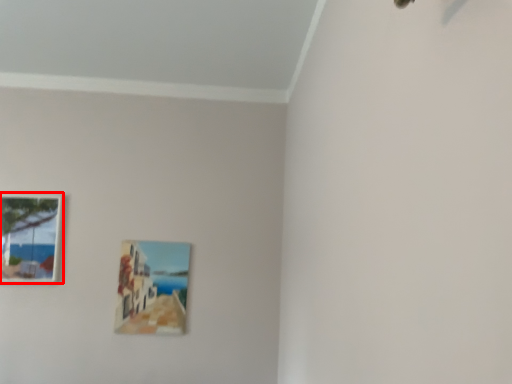
Question: From the image's perspective, what is the correct spatial positioning of picture frame (annotated by the red box) in reference to picture frame?

Choices:
 (A) below
 (B) above

Answer: (B)